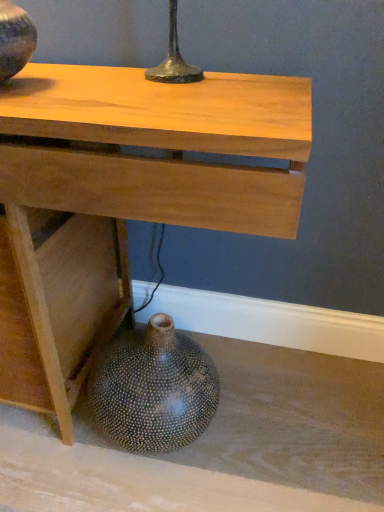
Question: Is speckled ceramic vase at lower left, placed as the 1th vase when sorted from back to front, situated inside matte black vase at upper left, placed as the 2th vase when sorted from back to front, or outside?

Choices:
 (A) inside
 (B) outside

Answer: (B)

Question: Considering the relative positions of speckled ceramic vase at lower left, the second vase positioned from the front, and matte black vase at upper left, the second vase when ordered from bottom to top, in the image provided, is speckled ceramic vase at lower left, the second vase positioned from the front, to the left or to the right of matte black vase at upper left, the second vase when ordered from bottom to top,?

Choices:
 (A) right
 (B) left

Answer: (A)

Question: Which of these objects is positioned farthest from the speckled ceramic vase at lower left, placed as the 1th vase when sorted from back to front?

Choices:
 (A) natural wood table at center
 (B) matte black vase at upper left, which is the 2th vase from right to left

Answer: (B)

Question: Which object is positioned closest to the natural wood table at center?

Choices:
 (A) matte black vase at upper left, arranged as the first vase when viewed from the top
 (B) speckled ceramic vase at lower left, arranged as the first vase when ordered from the bottom

Answer: (B)